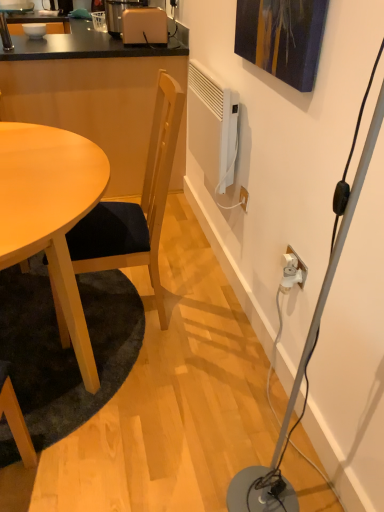
You are a GUI agent. You are given a task and a screenshot of the screen. Output one action in this format:
    pyautogui.click(x=<x>, y=<y>)
    Task: Click on the free space below wooden chair at center (from a real-world perspective)
    
    Given the screenshot: What is the action you would take?
    pyautogui.click(x=155, y=303)